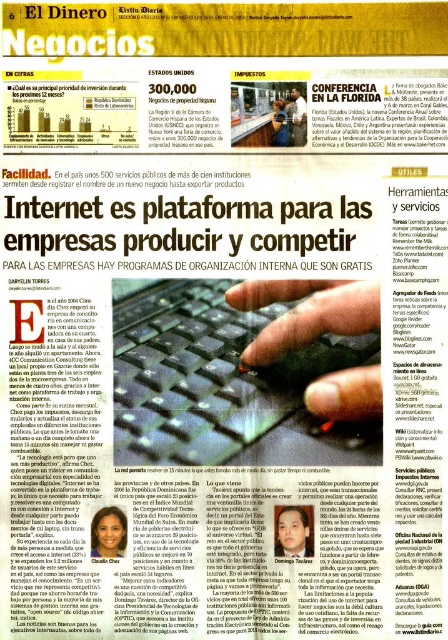
You are a journalist reviewing this newspaper page. You notice the matte black face at center and the matte black pen at center mentioned in the scene. Which object is positioned to the right?

The matte black pen at center is positioned to the right of the matte black face at center.

Based on the scene description, what is the position of the matte black face at center in the newspaper page?

The matte black face at center is located at point coordinates of 0.833 on the x axis and 0.241 on the y axis.

You are a remote worker who needs to place your black plastic keyboard at center and a camera so that they are exactly 36 inches apart for an ergonomic setup. According to the image, are they currently positioned correctly?

The black plastic keyboard at center and camera are 36.25 inches apart, which is slightly more than 36 inches. Therefore, they are not exactly positioned correctly for the desired ergonomic setup.